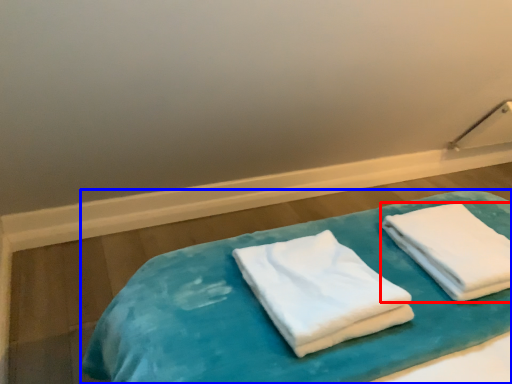
Question: Among these objects, which one is farthest to the camera, towel (highlighted by a red box) or bed (highlighted by a blue box)?

Choices:
 (A) towel
 (B) bed

Answer: (B)